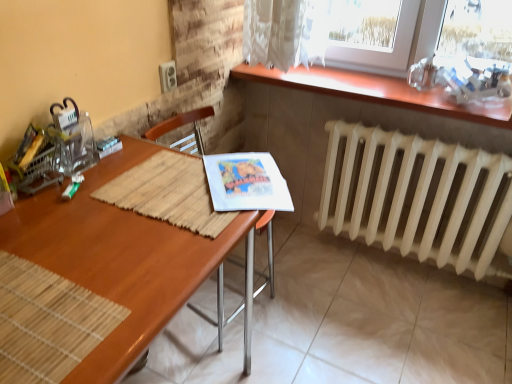
Question: Can you confirm if wooden chair at center is positioned to the left of wooden table at upper right?

Choices:
 (A) no
 (B) yes

Answer: (B)

Question: Is wooden chair at center bigger than wooden table at upper right?

Choices:
 (A) yes
 (B) no

Answer: (A)

Question: From the image's perspective, is wooden chair at center over wooden table at upper right?

Choices:
 (A) yes
 (B) no

Answer: (B)

Question: From a real-world perspective, is wooden chair at center under wooden table at upper right?

Choices:
 (A) yes
 (B) no

Answer: (A)

Question: Can wooden table at upper right be found inside wooden chair at center?

Choices:
 (A) no
 (B) yes

Answer: (A)

Question: Is wooden chair at center next to wooden table at upper right and touching it?

Choices:
 (A) yes
 (B) no

Answer: (B)

Question: Is white matte radiator at lower right at the back of wooden desk at center?

Choices:
 (A) yes
 (B) no

Answer: (B)

Question: Is wooden desk at center bigger than white matte radiator at lower right?

Choices:
 (A) yes
 (B) no

Answer: (A)

Question: From the image's perspective, does wooden desk at center appear higher than white matte radiator at lower right?

Choices:
 (A) no
 (B) yes

Answer: (A)

Question: From the image's perspective, is wooden desk at center beneath white matte radiator at lower right?

Choices:
 (A) no
 (B) yes

Answer: (B)

Question: Considering the relative sizes of wooden desk at center and white matte radiator at lower right in the image provided, is wooden desk at center shorter than white matte radiator at lower right?

Choices:
 (A) no
 (B) yes

Answer: (A)

Question: From a real-world perspective, is wooden desk at center physically above white matte radiator at lower right?

Choices:
 (A) yes
 (B) no

Answer: (A)

Question: Is white matte radiator at lower right directly adjacent to wooden chair at center?

Choices:
 (A) no
 (B) yes

Answer: (A)